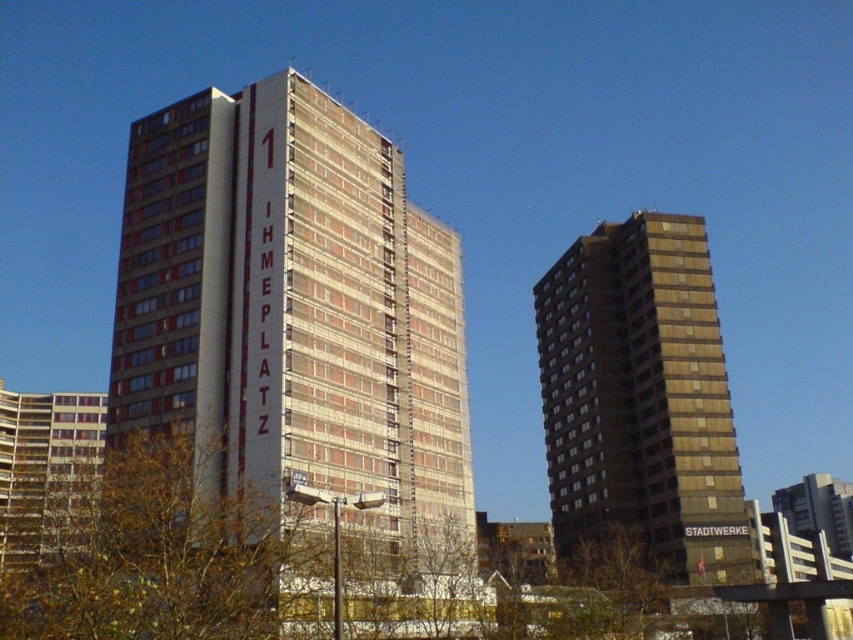
Question: Can you confirm if brick textured building at center is positioned to the left of brown matte building at right?

Choices:
 (A) yes
 (B) no

Answer: (A)

Question: Which point is closer to the camera?

Choices:
 (A) brown matte building at right
 (B) brick textured building at center

Answer: (B)

Question: Can you confirm if brick textured building at center is positioned above brown matte building at right?

Choices:
 (A) no
 (B) yes

Answer: (B)

Question: Which of the following is the farthest from the observer?

Choices:
 (A) 682,304
 (B) 250,332

Answer: (A)

Question: Does brick textured building at center have a larger size compared to brown matte building at right?

Choices:
 (A) yes
 (B) no

Answer: (A)